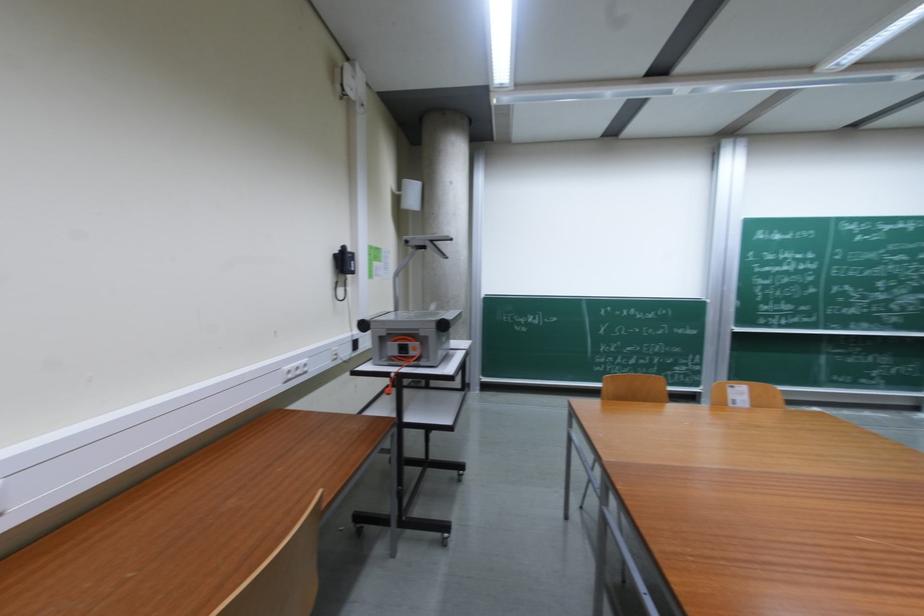
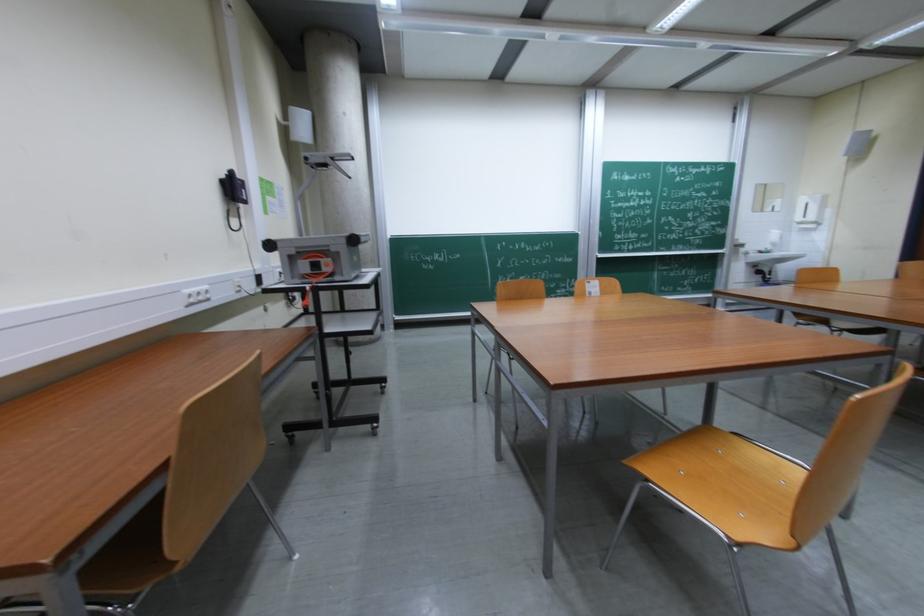
Question: Based on the continuous images, in which direction is the camera rotating? Reply with the corresponding letter.

Choices:
 (A) Left
 (B) Right
 (C) Up
 (D) Down

Answer: (B)